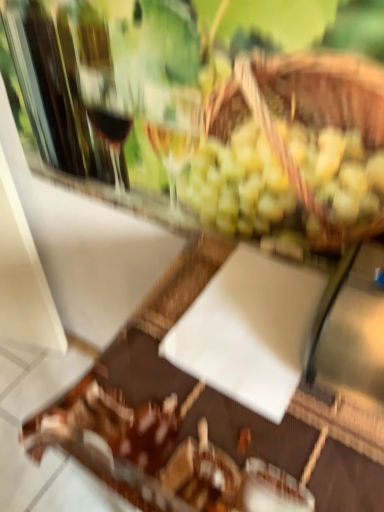
This screenshot has height=512, width=384. What are the coordinates of `vacant space situated above white matte cutting board at center (from a real-world perspective)` in the screenshot? It's located at (240, 375).